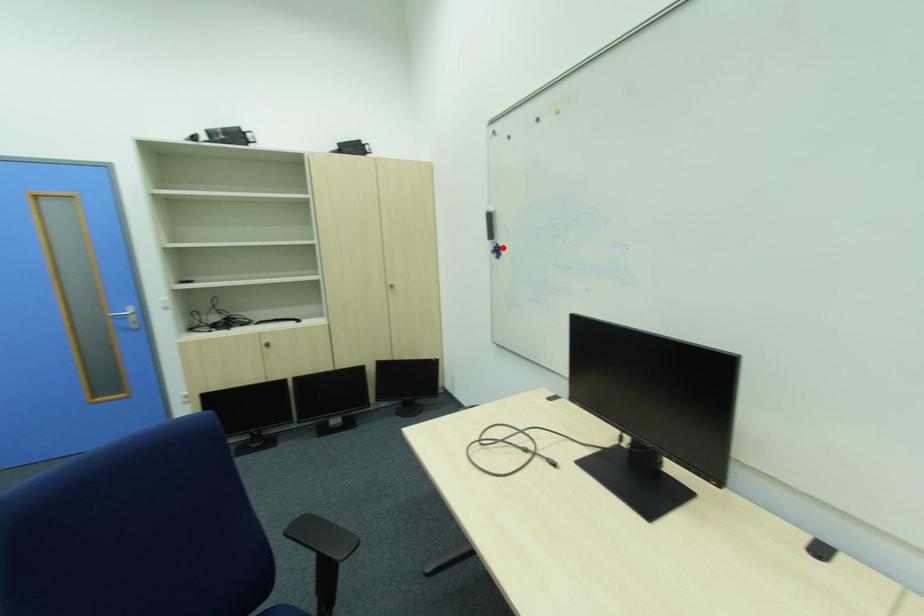
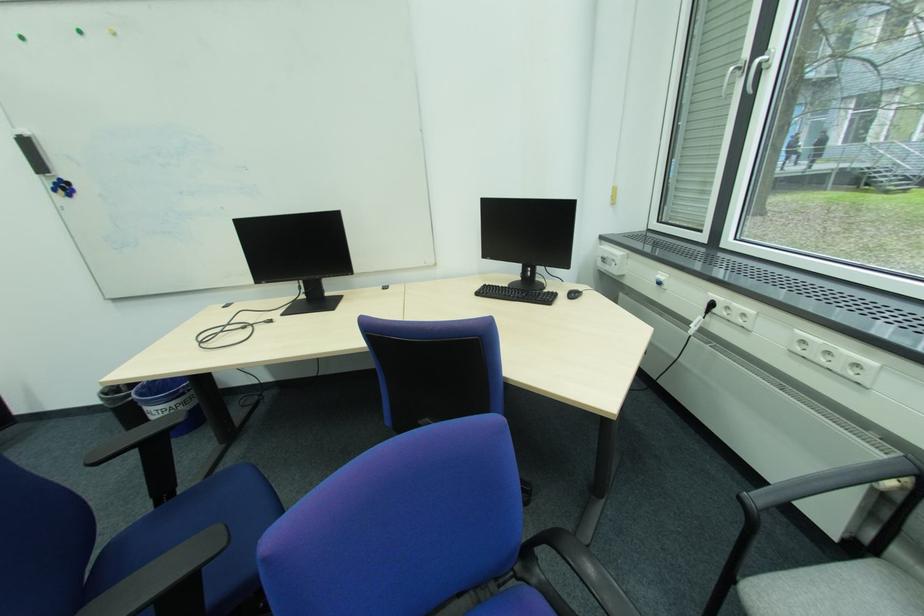
Locate, in the second image, the point that corresponds to the highlighted location in the first image.

(62, 185)